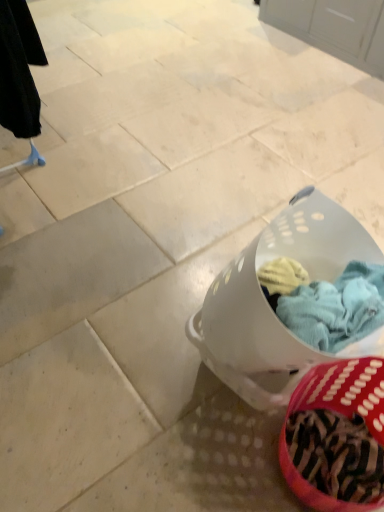
Question: From the image's perspective, is white plastic laundry basket at lower right below zebra-patterned fabric basket at lower right?

Choices:
 (A) no
 (B) yes

Answer: (A)

Question: Does white plastic laundry basket at lower right appear on the left side of zebra-patterned fabric basket at lower right?

Choices:
 (A) no
 (B) yes

Answer: (B)

Question: Can you confirm if white plastic laundry basket at lower right is thinner than zebra-patterned fabric basket at lower right?

Choices:
 (A) yes
 (B) no

Answer: (B)

Question: Is white plastic laundry basket at lower right in contact with zebra-patterned fabric basket at lower right?

Choices:
 (A) yes
 (B) no

Answer: (B)

Question: Does white plastic laundry basket at lower right have a lesser height compared to zebra-patterned fabric basket at lower right?

Choices:
 (A) no
 (B) yes

Answer: (A)

Question: Is white plastic laundry basket at lower right oriented towards zebra-patterned fabric basket at lower right?

Choices:
 (A) yes
 (B) no

Answer: (B)

Question: Does zebra-patterned fabric basket at lower right have a larger size compared to white plastic laundry basket at lower right?

Choices:
 (A) no
 (B) yes

Answer: (A)

Question: Considering the relative sizes of zebra-patterned fabric basket at lower right and white plastic laundry basket at lower right in the image provided, is zebra-patterned fabric basket at lower right smaller than white plastic laundry basket at lower right?

Choices:
 (A) no
 (B) yes

Answer: (B)

Question: Can you confirm if zebra-patterned fabric basket at lower right is taller than white plastic laundry basket at lower right?

Choices:
 (A) yes
 (B) no

Answer: (B)

Question: Would you say zebra-patterned fabric basket at lower right contains white plastic laundry basket at lower right?

Choices:
 (A) yes
 (B) no

Answer: (B)

Question: Considering the relative sizes of zebra-patterned fabric basket at lower right and white plastic laundry basket at lower right in the image provided, is zebra-patterned fabric basket at lower right wider than white plastic laundry basket at lower right?

Choices:
 (A) no
 (B) yes

Answer: (A)

Question: Is zebra-patterned fabric basket at lower right at the right side of white plastic laundry basket at lower right?

Choices:
 (A) no
 (B) yes

Answer: (B)

Question: Is white plastic laundry basket at lower right inside or outside of zebra-patterned fabric basket at lower right?

Choices:
 (A) outside
 (B) inside

Answer: (A)